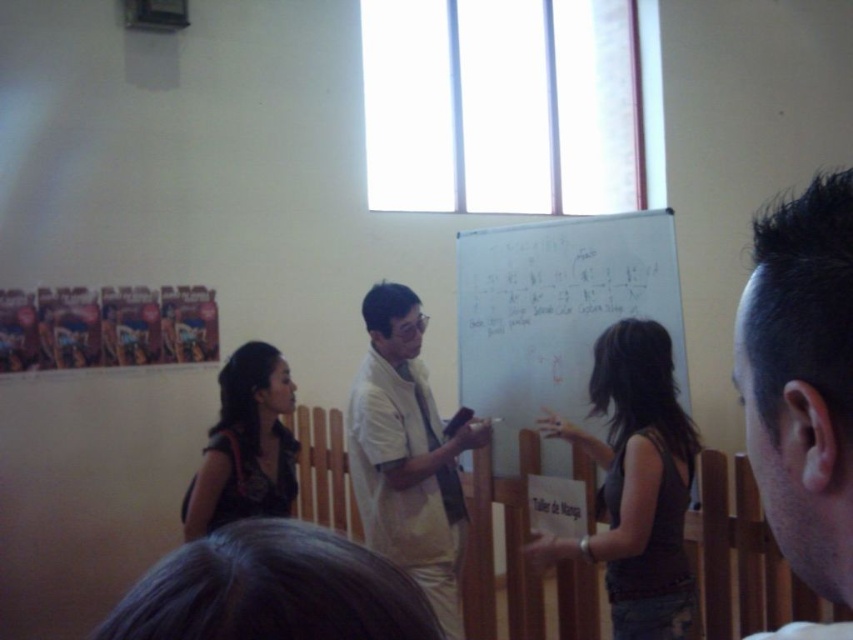
Question: Does whiteboard at center come behind white matte shirt at center?

Choices:
 (A) yes
 (B) no

Answer: (A)

Question: Which point is closer to the camera taking this photo?

Choices:
 (A) (590, 396)
 (B) (218, 445)
 (C) (664, 280)
 (D) (363, 416)

Answer: (A)

Question: Estimate the real-world distances between objects in this image. Which object is farther from the white matte shirt at center?

Choices:
 (A) dark brown tank top at center
 (B) dark brown hair at upper right

Answer: (B)

Question: Which point is closer to the camera?

Choices:
 (A) dark brown hair at upper right
 (B) white matte shirt at center
 (C) whiteboard at center

Answer: (A)

Question: Is dark brown tank top at center closer to the viewer compared to white matte shirt at center?

Choices:
 (A) no
 (B) yes

Answer: (B)

Question: Can you confirm if whiteboard at center is positioned below dark brown leather jacket at lower left?

Choices:
 (A) yes
 (B) no

Answer: (B)